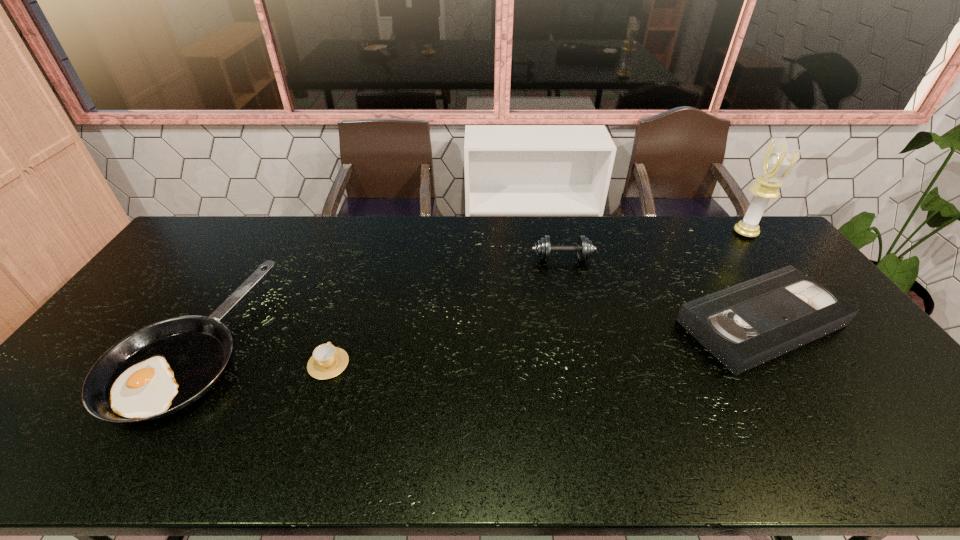
Identify the location of the farthest object. This screenshot has width=960, height=540. (778, 162).

Where is `award`? The image size is (960, 540). award is located at coordinates (778, 162).

Where is `dumbbell`? The height and width of the screenshot is (540, 960). dumbbell is located at coordinates pyautogui.click(x=584, y=248).

Where is `the fourth nearest object`? The image size is (960, 540). the fourth nearest object is located at coordinates (584, 248).

Find the location of `the leftmost object`. the leftmost object is located at coordinates (162, 368).

Identify the location of videotape. The width and height of the screenshot is (960, 540). (745, 325).

Locate an element on the screen. the fourth object from right to left is located at coordinates (327, 361).

Where is `cup`? Image resolution: width=960 pixels, height=540 pixels. cup is located at coordinates tap(327, 361).

This screenshot has height=540, width=960. I want to click on vacant space situated 0.060m on the front-facing side of the tallest object, so pyautogui.click(x=717, y=233).

This screenshot has height=540, width=960. Identify the location of free space located 0.230m on the front-facing side of the tallest object. (671, 233).